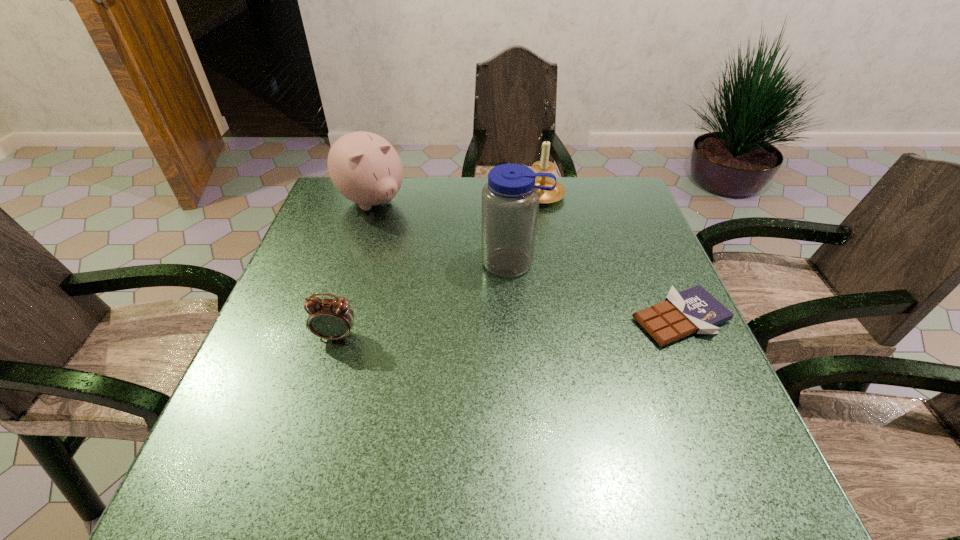
I want to click on free area in between the water bottle and the chocolate bar, so (x=597, y=291).

This screenshot has height=540, width=960. Identify the location of empty location between the candle holder and the fourth tallest object. (439, 266).

Where is `vacant space that is in between the piggy bank and the candle holder`? This screenshot has height=540, width=960. vacant space that is in between the piggy bank and the candle holder is located at coordinates (457, 199).

This screenshot has height=540, width=960. I want to click on empty location between the rightmost object and the tallest object, so click(x=597, y=291).

In order to click on free space between the third nearest object and the second shortest object in this screenshot , I will do `click(425, 299)`.

The width and height of the screenshot is (960, 540). Find the location of `empty location between the candle holder and the piggy bank`. empty location between the candle holder and the piggy bank is located at coordinates (457, 199).

Locate an element on the screen. free area in between the rightmost object and the alarm clock is located at coordinates (508, 327).

Locate an element on the screen. This screenshot has width=960, height=540. free space between the candle holder and the alarm clock is located at coordinates (439, 266).

Choose which object is the nearest neighbor to the fourth tallest object. Please provide its 2D coordinates. Your answer should be formatted as a tuple, i.e. [(x, y)], where the tuple contains the x and y coordinates of a point satisfying the conditions above.

[(510, 199)]

I want to click on object that is the nearest to the candle holder, so click(510, 199).